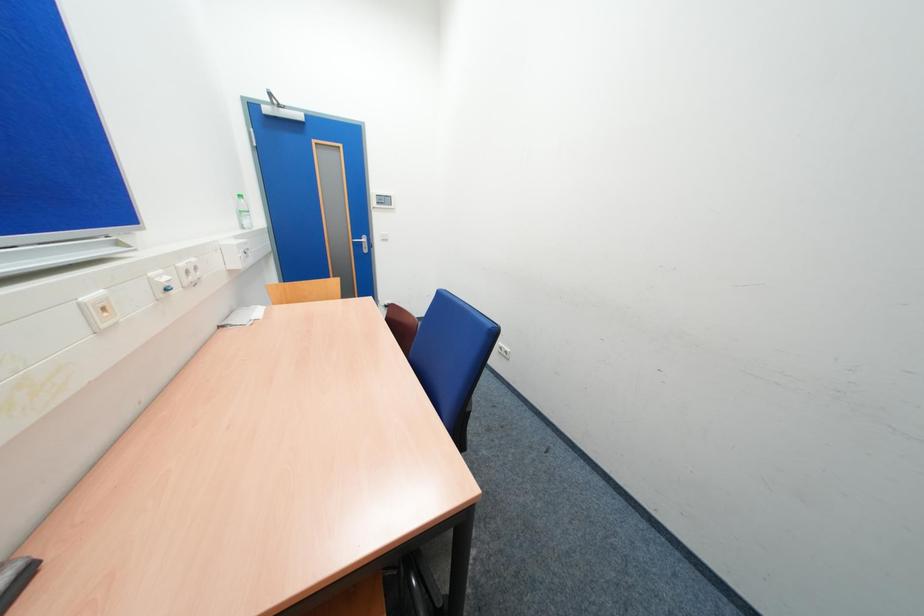
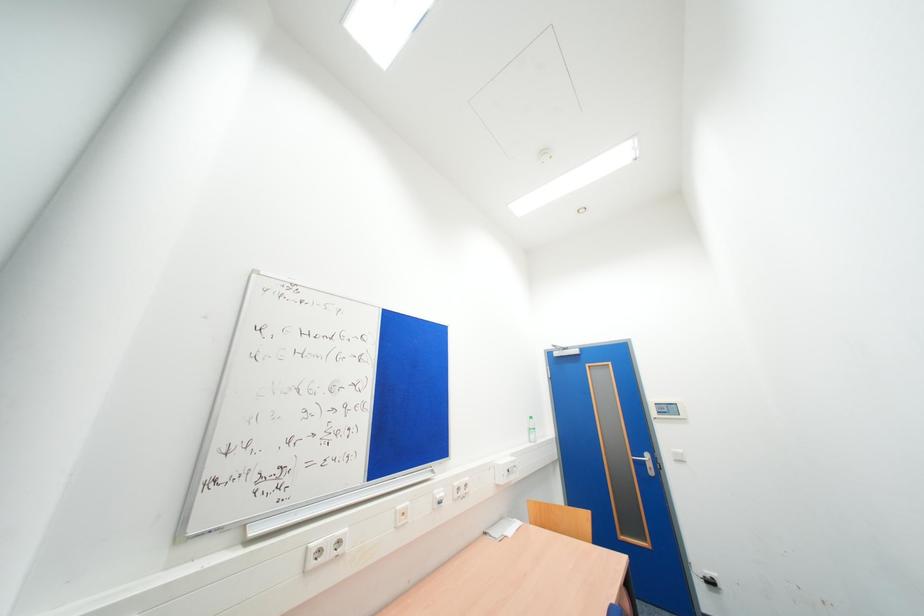
Based on the continuous images, in which direction is the camera rotating?

The camera's rotation is toward left-up.